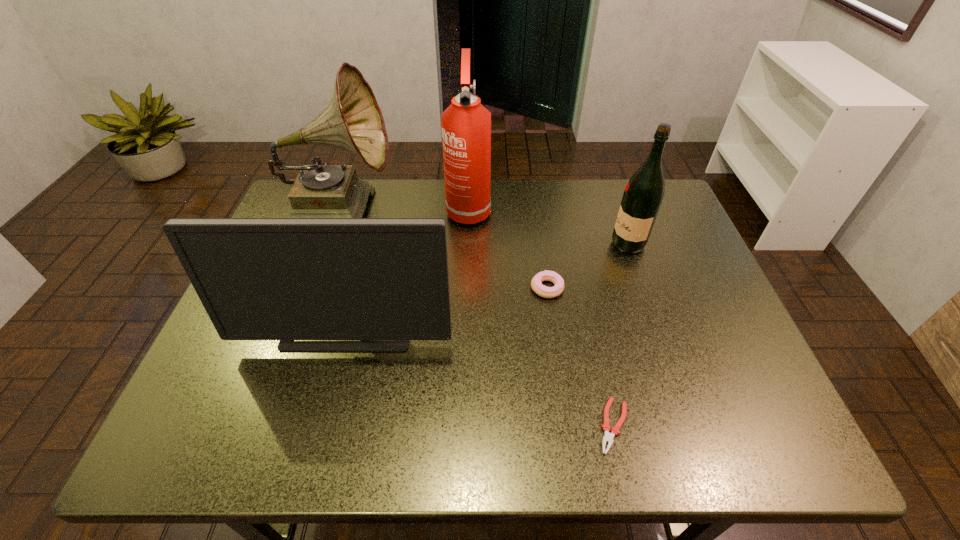
You are a GUI agent. You are given a task and a screenshot of the screen. Output one action in this format:
    pyautogui.click(x=<x>, y=<y>)
    Task: Click on the computer monitor that is at the left edge
    
    Given the screenshot: What is the action you would take?
    pyautogui.click(x=285, y=279)

I want to click on object that is at the right edge, so click(x=643, y=195).

The image size is (960, 540). I want to click on object present at the far left corner, so click(x=352, y=120).

Where is `free space at the far edge`? free space at the far edge is located at coordinates (403, 204).

Locate an element on the screen. This screenshot has height=540, width=960. vacant region at the left edge of the desktop is located at coordinates (227, 341).

Locate an element on the screen. vacant area at the right edge of the desktop is located at coordinates (670, 285).

The width and height of the screenshot is (960, 540). In order to click on free space between the nearest object and the fifth tallest object in this screenshot , I will do `click(581, 356)`.

The image size is (960, 540). Find the location of `blank region between the record player and the nearest object`. blank region between the record player and the nearest object is located at coordinates (477, 318).

At what (x,y) coordinates should I click in order to perform the action: click on free point between the fire extinguisher and the fifth object from left to right. Please return your answer as a coordinate pair (x, y). This screenshot has width=960, height=540. Looking at the image, I should click on (541, 317).

Where is `free space between the liquor and the doughnut`? This screenshot has height=540, width=960. free space between the liquor and the doughnut is located at coordinates (588, 266).